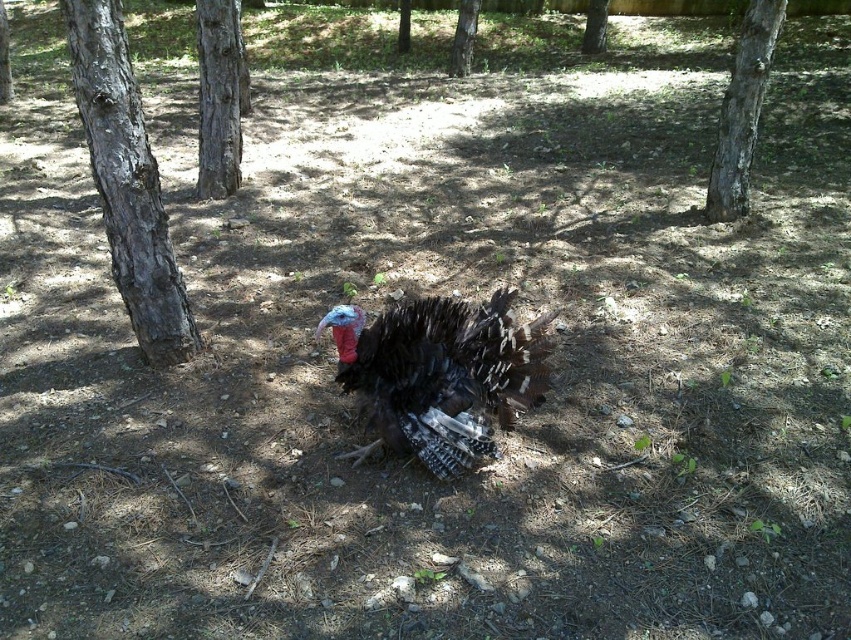
Which is more to the right, shiny black turkey at center or brown rough tree at upper center?

shiny black turkey at center is more to the right.

Is shiny black turkey at center in front of brown rough tree at upper center?

Yes.

Which is in front, point (347, 390) or point (408, 28)?

Point (347, 390) is in front.

Where is `shiny black turkey at center`? shiny black turkey at center is located at coordinates (440, 374).

Is dark brown bark tree at left closer to the viewer compared to brown rough tree at upper center?

Yes, dark brown bark tree at left is closer to the viewer.

Identify the location of dark brown bark tree at left. (127, 182).

This screenshot has width=851, height=640. What do you see at coordinates (127, 182) in the screenshot? I see `dark brown bark tree at left` at bounding box center [127, 182].

This screenshot has height=640, width=851. What are the coordinates of `dark brown bark tree at left` in the screenshot? It's located at coord(127,182).

Is shiny black turkey at center positioned at the back of smooth brown tree trunk at upper left?

No, shiny black turkey at center is closer to the viewer.

This screenshot has width=851, height=640. What are the coordinates of `shiny black turkey at center` in the screenshot? It's located at (440, 374).